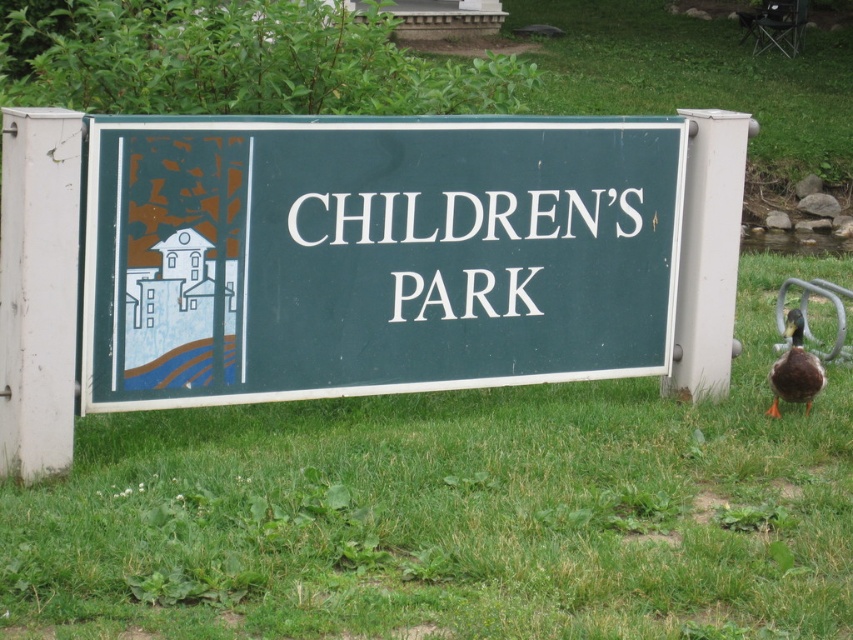
Does green matte sign at center have a larger size compared to brown matte duck at lower right?

Correct, green matte sign at center is larger in size than brown matte duck at lower right.

Is green matte sign at center taller than brown matte duck at lower right?

Yes.

This screenshot has width=853, height=640. Identify the location of green matte sign at center. (373, 253).

Locate an element on the screen. The width and height of the screenshot is (853, 640). green matte sign at center is located at coordinates (373, 253).

Does green grass at center appear over brown matte duck at lower right?

No, green grass at center is not above brown matte duck at lower right.

How distant is green grass at center from brown matte duck at lower right?

The distance of green grass at center from brown matte duck at lower right is 1.56 meters.

Describe the element at coordinates (456, 513) in the screenshot. The height and width of the screenshot is (640, 853). I see `green grass at center` at that location.

What are the coordinates of `green grass at center` in the screenshot? It's located at (456, 513).

Is green grass at center bigger than green matte sign at center?

Actually, green grass at center might be smaller than green matte sign at center.

Measure the distance between green grass at center and camera.

4.48 meters

This screenshot has width=853, height=640. I want to click on green grass at center, so click(x=456, y=513).